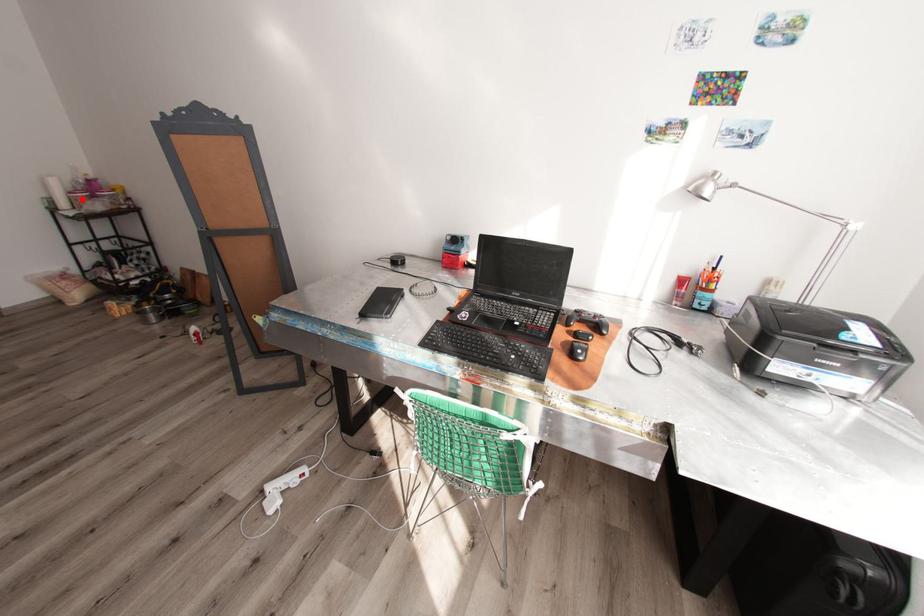
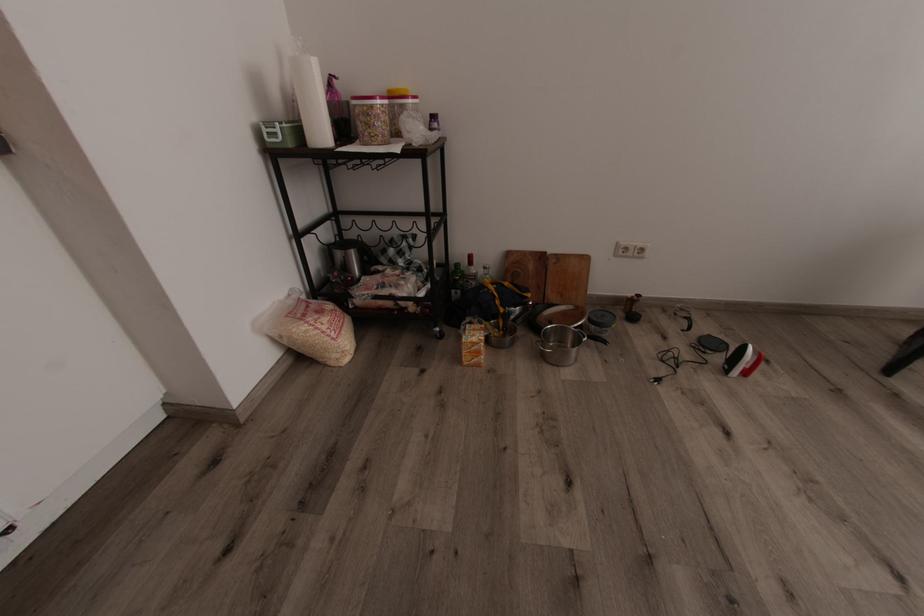
In the second image, find the point that corresponds to the highlighted location in the first image.

(382, 116)